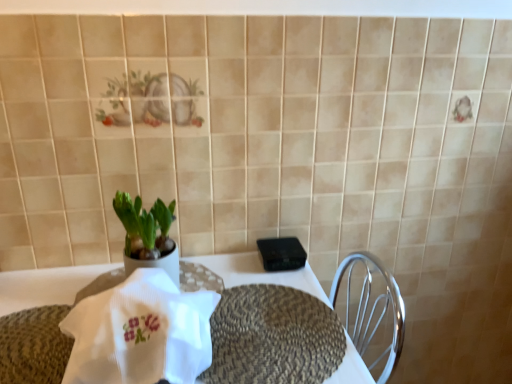
Question: Is black plastic device at center not inside white ribbed cloth at center?

Choices:
 (A) yes
 (B) no

Answer: (A)

Question: Is black plastic device at center turned away from white ribbed cloth at center?

Choices:
 (A) yes
 (B) no

Answer: (B)

Question: Considering the relative positions of black plastic device at center and white ribbed cloth at center in the image provided, is black plastic device at center to the right of white ribbed cloth at center from the viewer's perspective?

Choices:
 (A) no
 (B) yes

Answer: (B)

Question: Is black plastic device at center positioned behind white ribbed cloth at center?

Choices:
 (A) yes
 (B) no

Answer: (A)

Question: Is black plastic device at center wider than white ribbed cloth at center?

Choices:
 (A) yes
 (B) no

Answer: (B)

Question: Looking at their shapes, would you say braided woven placemat at center is wider or thinner than white ribbed cloth at center?

Choices:
 (A) wide
 (B) thin

Answer: (A)

Question: In the image, is braided woven placemat at center on the left side or the right side of white ribbed cloth at center?

Choices:
 (A) right
 (B) left

Answer: (A)

Question: Is braided woven placemat at center inside or outside of white ribbed cloth at center?

Choices:
 (A) inside
 (B) outside

Answer: (B)

Question: From a real-world perspective, is braided woven placemat at center physically located above or below white ribbed cloth at center?

Choices:
 (A) below
 (B) above

Answer: (A)

Question: Does point (291, 266) appear closer or farther from the camera than point (175, 367)?

Choices:
 (A) farther
 (B) closer

Answer: (A)

Question: In terms of size, does black plastic device at center appear bigger or smaller than white ribbed cloth at center?

Choices:
 (A) big
 (B) small

Answer: (B)

Question: From the image's perspective, is black plastic device at center positioned above or below white ribbed cloth at center?

Choices:
 (A) below
 (B) above

Answer: (B)

Question: From their relative heights in the image, would you say black plastic device at center is taller or shorter than white ribbed cloth at center?

Choices:
 (A) short
 (B) tall

Answer: (A)

Question: Is green matte plant at center in front of or behind white woven placemat at center in the image?

Choices:
 (A) behind
 (B) front

Answer: (A)

Question: Is green matte plant at center to the left or to the right of white woven placemat at center in the image?

Choices:
 (A) left
 (B) right

Answer: (A)